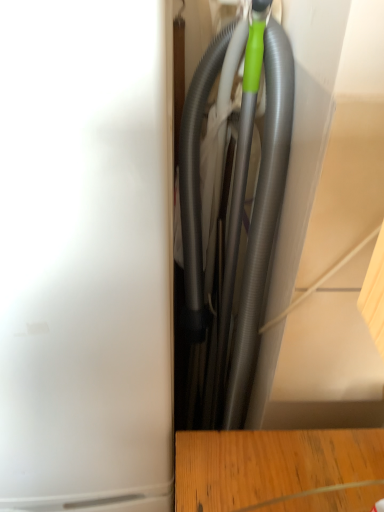
Locate an element on the screen. The width and height of the screenshot is (384, 512). matte gray vacuum cleaner at center is located at coordinates (85, 256).

Describe the element at coordinates (85, 256) in the screenshot. I see `matte gray vacuum cleaner at center` at that location.

Measure the distance between point [114,189] and camera.

14.88 inches.

The height and width of the screenshot is (512, 384). What do you see at coordinates (263, 216) in the screenshot?
I see `gray rubber garden hose at center` at bounding box center [263, 216].

The height and width of the screenshot is (512, 384). Find the location of `gray rubber garden hose at center`. gray rubber garden hose at center is located at coordinates (263, 216).

Locate an element on the screen. The width and height of the screenshot is (384, 512). matte gray vacuum cleaner at center is located at coordinates (85, 256).

Considering the relative positions of gray rubber garden hose at center and matte gray vacuum cleaner at center in the image provided, is gray rubber garden hose at center to the right of matte gray vacuum cleaner at center from the viewer's perspective?

Indeed, gray rubber garden hose at center is positioned on the right side of matte gray vacuum cleaner at center.

Considering their positions, is gray rubber garden hose at center located in front of or behind matte gray vacuum cleaner at center?

In the image, gray rubber garden hose at center appears behind matte gray vacuum cleaner at center.

Which is farther, (x=265, y=229) or (x=13, y=240)?

The point (x=265, y=229) is farther.

From the image's perspective, relative to matte gray vacuum cleaner at center, is gray rubber garden hose at center above or below?

Based on their image positions, gray rubber garden hose at center is located above matte gray vacuum cleaner at center.

In the scene shown: From a real-world perspective, who is located lower, gray rubber garden hose at center or matte gray vacuum cleaner at center?

In real-world perspective, matte gray vacuum cleaner at center is lower.

Does gray rubber garden hose at center have a lesser width compared to matte gray vacuum cleaner at center?

Yes.

Considering the sizes of objects gray rubber garden hose at center and matte gray vacuum cleaner at center in the image provided, who is shorter, gray rubber garden hose at center or matte gray vacuum cleaner at center?

With less height is gray rubber garden hose at center.

In terms of size, does gray rubber garden hose at center appear bigger or smaller than matte gray vacuum cleaner at center?

gray rubber garden hose at center is smaller than matte gray vacuum cleaner at center.

In the scene shown: Does gray rubber garden hose at center contain matte gray vacuum cleaner at center?

No, matte gray vacuum cleaner at center is not inside gray rubber garden hose at center.

Are gray rubber garden hose at center and matte gray vacuum cleaner at center far apart?

No, gray rubber garden hose at center is in close proximity to matte gray vacuum cleaner at center.

Could you tell me if gray rubber garden hose at center is facing matte gray vacuum cleaner at center?

Yes, gray rubber garden hose at center faces towards matte gray vacuum cleaner at center.

Consider the image. What's the angular difference between gray rubber garden hose at center and matte gray vacuum cleaner at center's facing directions?

They differ by 89.3 degrees in their facing directions.

The width and height of the screenshot is (384, 512). What are the coordinates of `appliance lying below the gray rubber garden hose at center (from the image's perspective)` in the screenshot? It's located at (85, 256).

Which is more to the right, matte gray vacuum cleaner at center or gray rubber garden hose at center?

gray rubber garden hose at center is more to the right.

Considering the relative positions of matte gray vacuum cleaner at center and gray rubber garden hose at center in the image provided, is matte gray vacuum cleaner at center in front of gray rubber garden hose at center?

That is True.

Which is behind, point (140, 132) or point (228, 407)?

The point (228, 407) is behind.

From the image's perspective, is matte gray vacuum cleaner at center on top of gray rubber garden hose at center?

Actually, matte gray vacuum cleaner at center appears below gray rubber garden hose at center in the image.

From a real-world perspective, which is physically above, matte gray vacuum cleaner at center or gray rubber garden hose at center?

gray rubber garden hose at center is physically above.

Which object is wider, matte gray vacuum cleaner at center or gray rubber garden hose at center?

matte gray vacuum cleaner at center.

Is matte gray vacuum cleaner at center taller or shorter than gray rubber garden hose at center?

Considering their sizes, matte gray vacuum cleaner at center has more height than gray rubber garden hose at center.

In terms of size, does matte gray vacuum cleaner at center appear bigger or smaller than gray rubber garden hose at center?

Clearly, matte gray vacuum cleaner at center is larger in size than gray rubber garden hose at center.

Is gray rubber garden hose at center completely or partially inside matte gray vacuum cleaner at center?

No.

From the picture: Are matte gray vacuum cleaner at center and gray rubber garden hose at center far apart?

That's not correct — matte gray vacuum cleaner at center is a little close to gray rubber garden hose at center.

Is matte gray vacuum cleaner at center facing away from gray rubber garden hose at center?

No, matte gray vacuum cleaner at center's orientation is not away from gray rubber garden hose at center.

Consider the image. What's the angular difference between matte gray vacuum cleaner at center and gray rubber garden hose at center's facing directions?

89.3 degrees separate the facing orientations of matte gray vacuum cleaner at center and gray rubber garden hose at center.

How much distance is there between matte gray vacuum cleaner at center and gray rubber garden hose at center?

matte gray vacuum cleaner at center and gray rubber garden hose at center are 11.11 inches apart.

This screenshot has height=512, width=384. Identify the location of garden hose above the matte gray vacuum cleaner at center (from a real-world perspective). (263, 216).

Identify the location of appliance that is in front of the gray rubber garden hose at center. [85, 256].

Find the location of a particular element. The height and width of the screenshot is (512, 384). appliance below the gray rubber garden hose at center (from the image's perspective) is located at coordinates (85, 256).